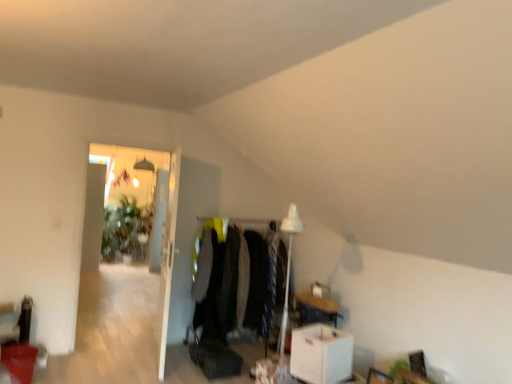
Question: From the image's perspective, is transparent glass door at left on top of white cardboard box at lower right?

Choices:
 (A) yes
 (B) no

Answer: (A)

Question: Is transparent glass door at left to the right of white cardboard box at lower right from the viewer's perspective?

Choices:
 (A) yes
 (B) no

Answer: (B)

Question: Is transparent glass door at left at the left side of white cardboard box at lower right?

Choices:
 (A) yes
 (B) no

Answer: (A)

Question: Could you tell me if transparent glass door at left is facing white cardboard box at lower right?

Choices:
 (A) no
 (B) yes

Answer: (A)

Question: Can you confirm if transparent glass door at left is bigger than white cardboard box at lower right?

Choices:
 (A) no
 (B) yes

Answer: (B)

Question: Considering the relative sizes of transparent glass door at left and white cardboard box at lower right in the image provided, is transparent glass door at left smaller than white cardboard box at lower right?

Choices:
 (A) no
 (B) yes

Answer: (A)

Question: Considering the relative positions of velvet black coat at center and white glossy door at upper left in the image provided, is velvet black coat at center to the right of white glossy door at upper left from the viewer's perspective?

Choices:
 (A) no
 (B) yes

Answer: (B)

Question: Is velvet black coat at center positioned with its back to white glossy door at upper left?

Choices:
 (A) no
 (B) yes

Answer: (A)

Question: Considering the relative sizes of velvet black coat at center and white glossy door at upper left in the image provided, is velvet black coat at center bigger than white glossy door at upper left?

Choices:
 (A) yes
 (B) no

Answer: (A)

Question: Is velvet black coat at center outside of white glossy door at upper left?

Choices:
 (A) yes
 (B) no

Answer: (A)

Question: Can you confirm if velvet black coat at center is positioned to the left of white glossy door at upper left?

Choices:
 (A) no
 (B) yes

Answer: (A)

Question: Considering the relative sizes of velvet black coat at center and white glossy door at upper left in the image provided, is velvet black coat at center shorter than white glossy door at upper left?

Choices:
 (A) yes
 (B) no

Answer: (A)

Question: Is white glossy door at upper left closer to the viewer compared to transparent glass door at left?

Choices:
 (A) yes
 (B) no

Answer: (A)